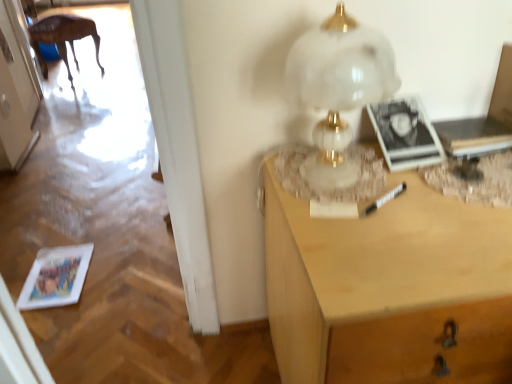
The width and height of the screenshot is (512, 384). What are the coordinates of `vacant space in front of matte paper magazine at lower left` in the screenshot? It's located at (57, 318).